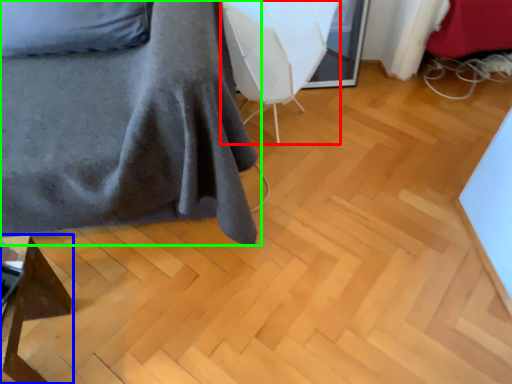
Question: Considering the real-world distances, which object is farthest from swivel chair (highlighted by a red box)? furniture (highlighted by a blue box) or furniture (highlighted by a green box)?

Choices:
 (A) furniture
 (B) furniture

Answer: (A)